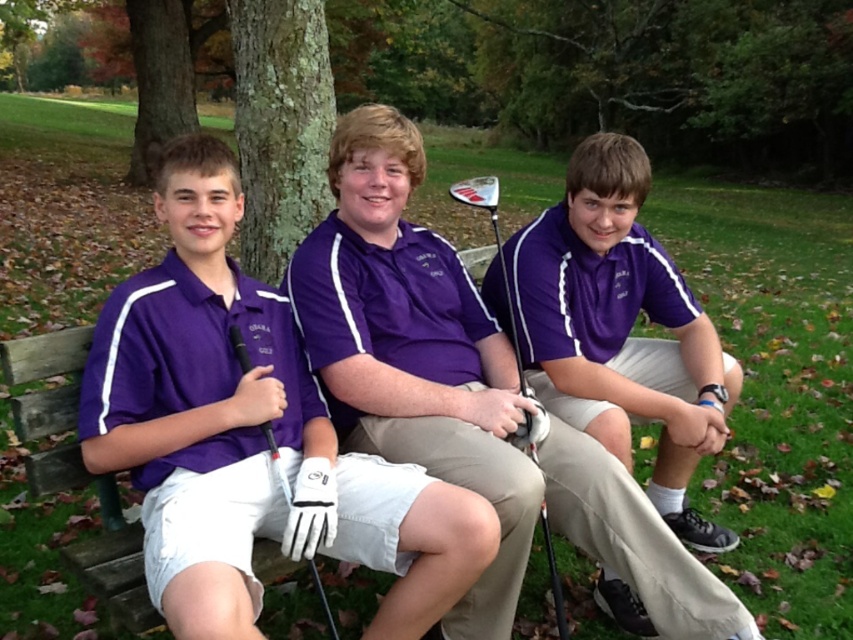
You are a photographer setting up for a group photo. You notice the purple cotton polo shirt at center and the matte white golf club at center. Which object is wider when viewed from the front?

The purple cotton polo shirt at center is wider than the matte white golf club at center.

You are a golfer trying to choose between two golf clubs on the bench. The purple matte golf club at center and the black rubber golf club at center are both available. Based on their widths, which one is wider?

The purple matte golf club at center is wider than the black rubber golf club at center.

You are a photographer setting up a shot of the three people on the bench. You want to ensure the purple cotton polo shirt at center and the matte white golf club at center are both visible. Which object should you focus on first to capture both in the frame?

The purple cotton polo shirt at center is located below the matte white golf club at center. Since the polo shirt is lower, you should focus on the matte white golf club at center first to ensure both are in the frame.